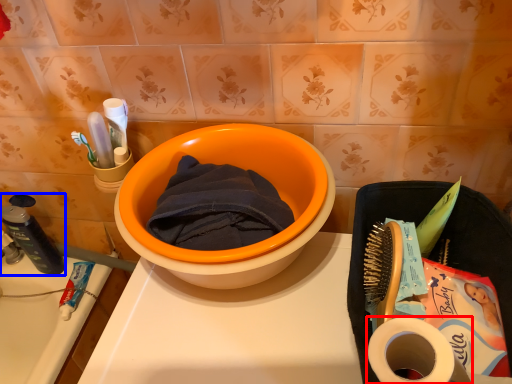
Question: Which point is closer to the camera, toilet paper (highlighted by a red box) or stationery (highlighted by a blue box)?

Choices:
 (A) toilet paper
 (B) stationery

Answer: (A)